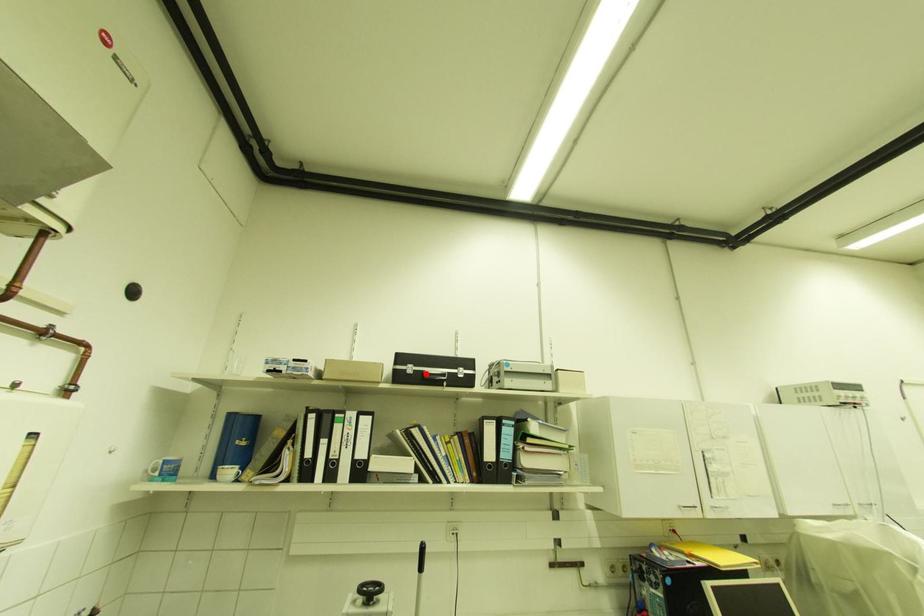
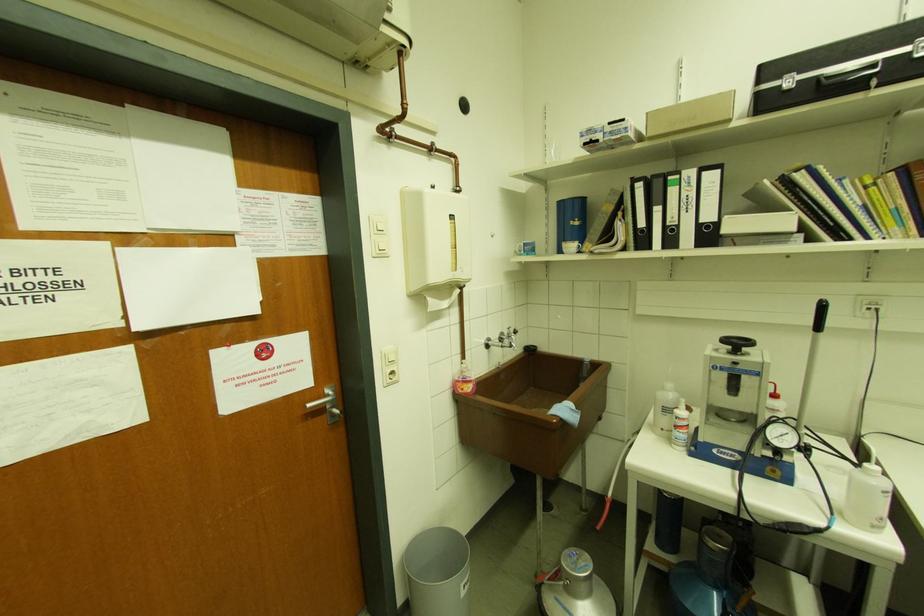
Question: I am providing you with two images of the same scene from different viewpoints. A red point is marked on the first image. Is the red point's position out of view in image 2?

Choices:
 (A) Yes
 (B) No

Answer: (B)